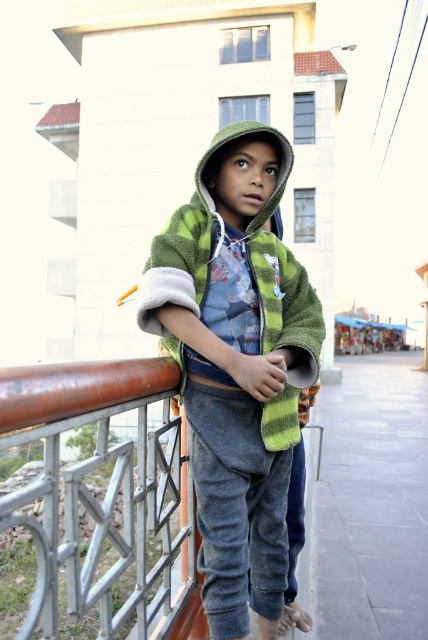
You are a drone operator trying to capture a photo of the child on the balcony. The rusty metal fence at left is in the way of your shot. Can you adjust your camera angle to avoid the fence?

The rusty metal fence at left is positioned at point (104, 493), so you can adjust your camera angle to avoid it by moving the camera to the right or upward to frame the child without the fence obstructing the view.

You are a delivery robot with a width of 3 feet. You need to move from the rusty metal fence at left to the green fuzzy jacket at center. Is there enough space for you to pass through the gap between them?

The distance between the rusty metal fence at left and the green fuzzy jacket at center is 4.92 feet, which is wider than the robot width of 3 feet. Yes, there is enough space for the robot to pass through the gap between them.